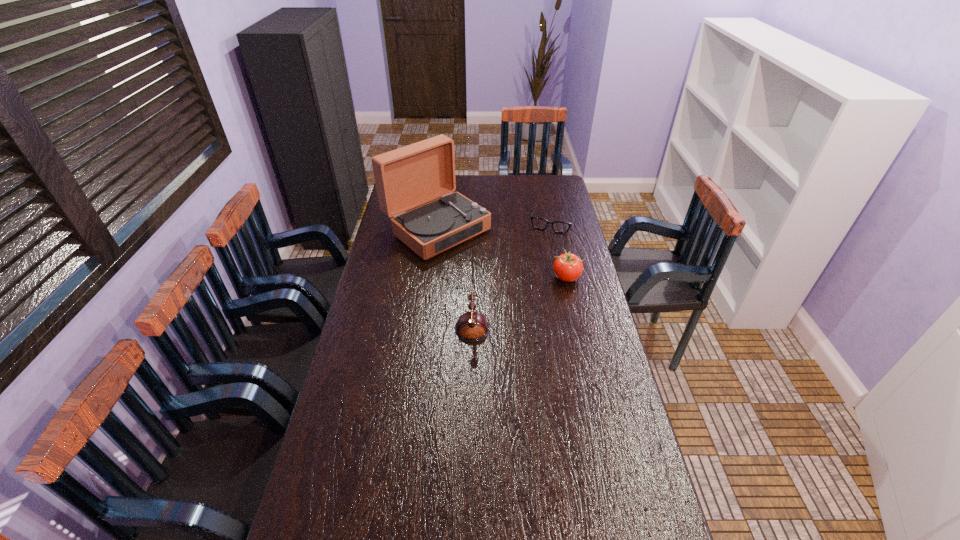
Locate an element on the screen. free space between the telephone and the shortest object is located at coordinates (510, 268).

Identify the location of unoccupied area between the phonograph record and the tomato. This screenshot has height=540, width=960. (501, 253).

The width and height of the screenshot is (960, 540). In order to click on object that is the second closest to the spectacles in this screenshot , I will do `click(567, 267)`.

Image resolution: width=960 pixels, height=540 pixels. I want to click on object that stands as the closest to the spectacles, so click(x=407, y=177).

You are a GUI agent. You are given a task and a screenshot of the screen. Output one action in this format:
    pyautogui.click(x=<x>, y=<y>)
    Task: Click on the free space in the image that satisfies the following two spatial constraints: 1. on the front side of the phonograph record; 2. on the rotary dial of the telephone
    
    Given the screenshot: What is the action you would take?
    pyautogui.click(x=425, y=314)

At what (x,y) coordinates should I click in order to perform the action: click on blank area in the image that satisfies the following two spatial constraints: 1. on the front side of the telephone; 2. on the rotary dial of the phonograph record. Please return your answer as a coordinate pair (x, y). The height and width of the screenshot is (540, 960). Looking at the image, I should click on (425, 314).

You are a GUI agent. You are given a task and a screenshot of the screen. Output one action in this format:
    pyautogui.click(x=<x>, y=<y>)
    Task: Click on the vacant space that satisfies the following two spatial constraints: 1. on the front side of the tallest object; 2. on the left side of the tomato
    The width and height of the screenshot is (960, 540).
    Given the screenshot: What is the action you would take?
    pyautogui.click(x=430, y=278)